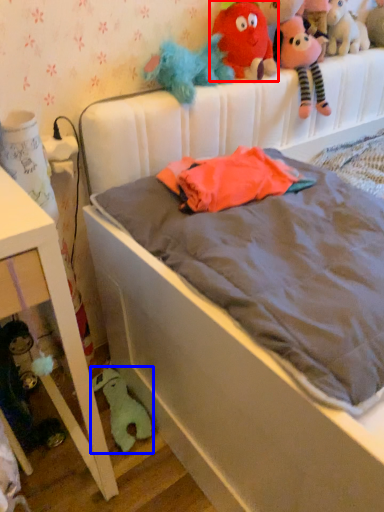
Question: Which of the following is the closest to the observer, toy (highlighted by a red box) or toy (highlighted by a blue box)?

Choices:
 (A) toy
 (B) toy

Answer: (A)